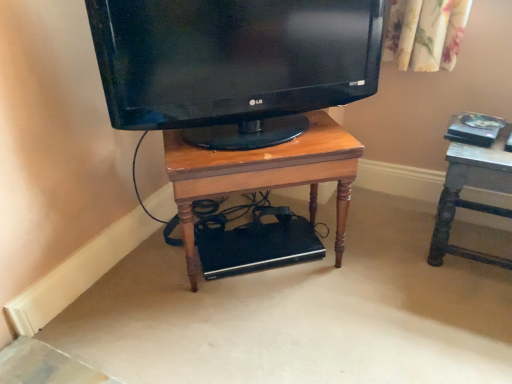
Where is `free space in front of wooden table at right`? free space in front of wooden table at right is located at coordinates pos(468,304).